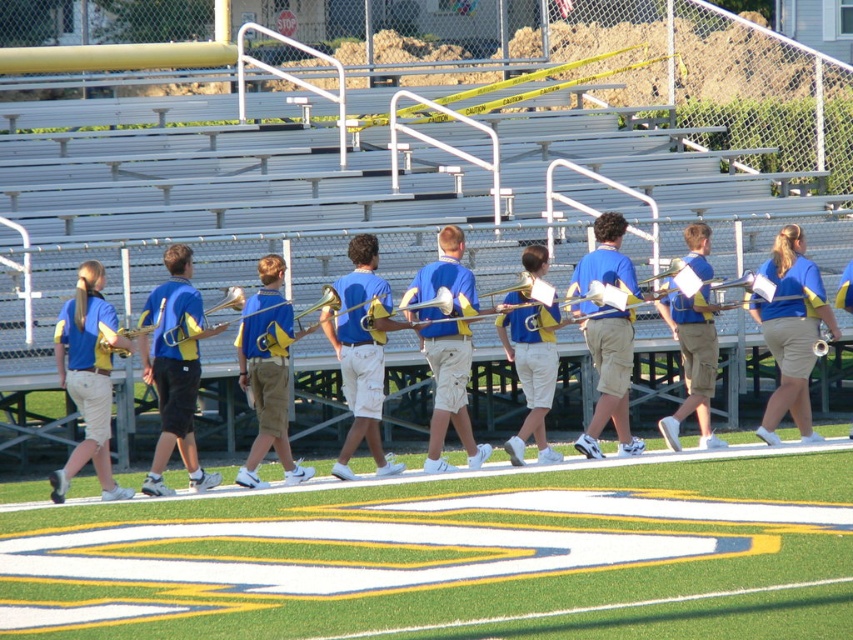
Question: Which object is positioned closest to the white synthetic turf at center?

Choices:
 (A) matte brass trombone at left
 (B) yellow brass trombone at center
 (C) matte blue shirt at left
 (D) shiny gold trombone at center

Answer: (C)

Question: Which of the following is the farthest from the observer?

Choices:
 (A) (669, 552)
 (B) (219, 326)

Answer: (B)

Question: Can you confirm if white synthetic turf at center is positioned to the right of matte blue shirt at left?

Choices:
 (A) yes
 (B) no

Answer: (A)

Question: Is gold/yellow brass trombone at center closer to camera compared to matte brass trombone at left?

Choices:
 (A) yes
 (B) no

Answer: (B)

Question: Does blue/yellow uniform at center have a smaller size compared to yellow brass trombone at center?

Choices:
 (A) yes
 (B) no

Answer: (A)

Question: Considering the real-world distances, which object is closest to the gold/yellow brass trombone at center?

Choices:
 (A) matte blue shirt at left
 (B) white synthetic turf at center
 (C) yellow brass trombone at center

Answer: (C)